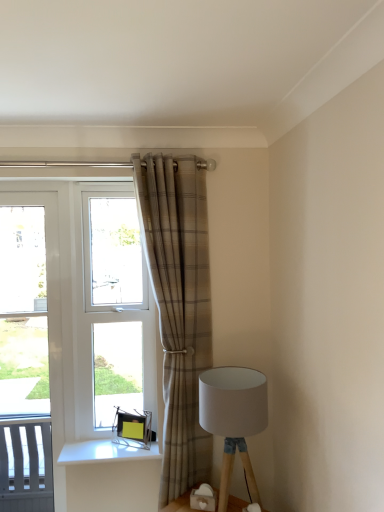
You are a GUI agent. You are given a task and a screenshot of the screen. Output one action in this format:
    pyautogui.click(x=<x>, y=<y>)
    Task: Click on the plaid fabric curtain at center
    
    Given the screenshot: What is the action you would take?
    pyautogui.click(x=179, y=308)

The width and height of the screenshot is (384, 512). What do you see at coordinates (233, 418) in the screenshot?
I see `white fabric lampshade at lower right` at bounding box center [233, 418].

Find the location of a particular element. This screenshot has height=512, width=384. clear glass window at center is located at coordinates (117, 304).

Measure the distance between point (55, 489) and camera.

A distance of 7.62 feet exists between point (55, 489) and camera.

Identify the location of plaid fabric curtain at center. (179, 308).

In the image, is white plastic screen door at left on the left side or the right side of plaid fabric curtain at center?

In the image, white plastic screen door at left appears on the left side of plaid fabric curtain at center.

Where is `screen door below the plaid fabric curtain at center (from the image's perspective)`? This screenshot has height=512, width=384. screen door below the plaid fabric curtain at center (from the image's perspective) is located at coordinates (49, 316).

Which of these two, white plastic screen door at left or plaid fabric curtain at center, is wider?

plaid fabric curtain at center.

From the image's perspective, is white plastic screen door at left located above plaid fabric curtain at center?

No, from the image's perspective, white plastic screen door at left is not on top of plaid fabric curtain at center.

Which object is thinner, clear glass window at center or plaid fabric curtain at center?

clear glass window at center.

In order to click on window that appears above the plaid fabric curtain at center (from the image's perspective) in this screenshot , I will do coord(117,304).

Could you tell me if clear glass window at center is turned towards plaid fabric curtain at center?

No, clear glass window at center does not turn towards plaid fabric curtain at center.

Does white plastic screen door at left appear on the left side of white fabric lampshade at lower right?

Correct, you'll find white plastic screen door at left to the left of white fabric lampshade at lower right.

From a real-world perspective, is white plastic screen door at left beneath white fabric lampshade at lower right?

No, from a real-world perspective, white plastic screen door at left is not under white fabric lampshade at lower right.

Is white plastic screen door at left positioned with its back to white fabric lampshade at lower right?

No, white plastic screen door at left is not facing the opposite direction of white fabric lampshade at lower right.

Is white plastic screen door at left inside or outside of white fabric lampshade at lower right?

white plastic screen door at left lies outside white fabric lampshade at lower right.

Is plaid fabric curtain at center positioned far away from white plastic screen door at left?

No, plaid fabric curtain at center is not far away from white plastic screen door at left.

How distant is plaid fabric curtain at center from white plastic screen door at left?

plaid fabric curtain at center is 27.15 inches away from white plastic screen door at left.

Is plaid fabric curtain at center oriented towards white plastic screen door at left?

No, plaid fabric curtain at center is not aimed at white plastic screen door at left.

Where is `screen door lying on the left of plaid fabric curtain at center`? The height and width of the screenshot is (512, 384). screen door lying on the left of plaid fabric curtain at center is located at coordinates (49, 316).

Which object is wider, plaid fabric curtain at center or white fabric lampshade at lower right?

white fabric lampshade at lower right.

Is plaid fabric curtain at center facing towards white fabric lampshade at lower right?

No, plaid fabric curtain at center is not turned towards white fabric lampshade at lower right.

Which object is further away from the camera taking this photo, white fabric lampshade at lower right or clear glass window at center?

clear glass window at center is more distant.

Is white fabric lampshade at lower right directly adjacent to clear glass window at center?

No, white fabric lampshade at lower right is not next to clear glass window at center.

Is point (263, 425) closer or farther from the camera than point (131, 382)?

Point (263, 425).

From a real-world perspective, relative to clear glass window at center, is white fabric lampshade at lower right vertically above or below?

Clearly, from a real-world perspective, white fabric lampshade at lower right is below clear glass window at center.

Is white plastic screen door at left to the left of clear glass window at center from the viewer's perspective?

Correct, you'll find white plastic screen door at left to the left of clear glass window at center.

Is white plastic screen door at left further to camera compared to clear glass window at center?

No, white plastic screen door at left is closer to the camera.

The image size is (384, 512). Identify the location of screen door below the clear glass window at center (from the image's perspective). (49, 316).

Which of these two, white plastic screen door at left or clear glass window at center, stands taller?

With more height is white plastic screen door at left.

Find the location of `curtain in front of the white plastic screen door at left`. curtain in front of the white plastic screen door at left is located at coordinates (179, 308).

This screenshot has height=512, width=384. In order to click on window above the plaid fabric curtain at center (from a real-world perspective) in this screenshot , I will do `click(117, 304)`.

From the image, which object appears to be nearer to plaid fabric curtain at center, white fabric lampshade at lower right or white plastic screen door at left?

white fabric lampshade at lower right lies closer to plaid fabric curtain at center than the other object.

Looking at the image, which one is located closer to white fabric lampshade at lower right, plaid fabric curtain at center or clear glass window at center?

Among the two, plaid fabric curtain at center is located nearer to white fabric lampshade at lower right.

Based on the photo, which object lies further to the anchor point white plastic screen door at left, white fabric lampshade at lower right or clear glass window at center?

white fabric lampshade at lower right.

Estimate the real-world distances between objects in this image. Which object is closer to white fabric lampshade at lower right, white plastic screen door at left or clear glass window at center?

The object closer to white fabric lampshade at lower right is clear glass window at center.

From the image, which object appears to be nearer to plaid fabric curtain at center, white plastic screen door at left or white fabric lampshade at lower right?

white fabric lampshade at lower right is closer to plaid fabric curtain at center.

From the picture: Considering their positions, is clear glass window at center positioned further to plaid fabric curtain at center than white plastic screen door at left?

Among the two, white plastic screen door at left is located further to plaid fabric curtain at center.

Looking at the image, which one is located closer to clear glass window at center, plaid fabric curtain at center or white fabric lampshade at lower right?

The object closer to clear glass window at center is plaid fabric curtain at center.

Which object lies further to the anchor point white fabric lampshade at lower right, plaid fabric curtain at center or white plastic screen door at left?

white plastic screen door at left lies further to white fabric lampshade at lower right than the other object.

What are the coordinates of `window situated between white plastic screen door at left and white fabric lampshade at lower right from left to right` in the screenshot? It's located at (117, 304).

This screenshot has height=512, width=384. Identify the location of curtain situated between clear glass window at center and white fabric lampshade at lower right from left to right. (179, 308).

The image size is (384, 512). In order to click on window between white plastic screen door at left and plaid fabric curtain at center in the horizontal direction in this screenshot , I will do [117, 304].

Find the location of a particular element. curtain situated between white plastic screen door at left and white fabric lampshade at lower right from left to right is located at coordinates (179, 308).